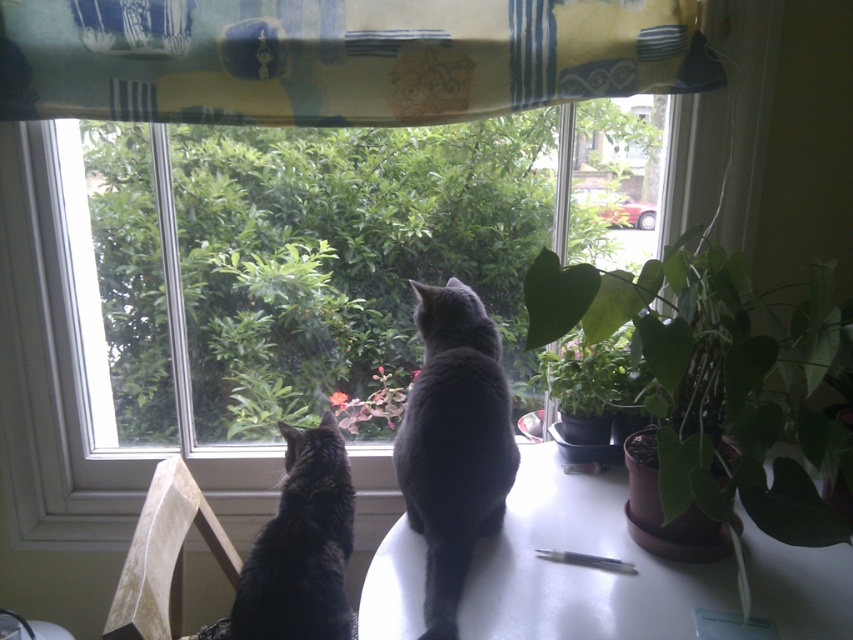
You are a cat lover trying to take a photo of the matte gray cat at center from above. Can you position yourself directly above the white glossy table at center to get a clear shot?

The white glossy table at center is located below matte gray cat at center, so positioning yourself directly above the white glossy table at center would place you directly under the matte gray cat at center, making it difficult to capture a clear photo from above.

You are taking a photo of the two cats on the white table. The cats are at point (680, 500) and point (418, 310). Which cat is in the foreground of the photo?

Point (680, 500) is closer to the camera than point (418, 310), so the cat at point (680, 500) is in the foreground of the photo.

You are a cat owner trying to ensure your cats can see the garden outside the window. The green matte plant at right and the matte gray cat at center are on the table. Which object is positioned to the right of the other?

The green matte plant at right is positioned to the right of the matte gray cat at center.